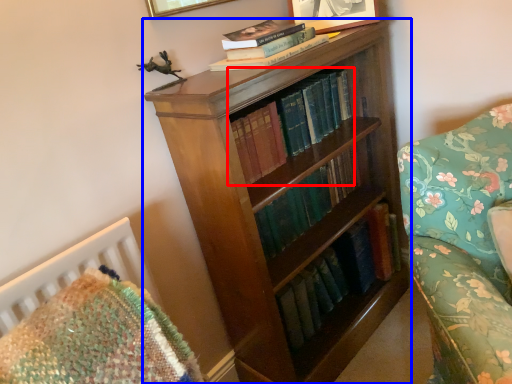
Question: Among these objects, which one is nearest to the camera, book (highlighted by a red box) or bookcase (highlighted by a blue box)?

Choices:
 (A) book
 (B) bookcase

Answer: (B)